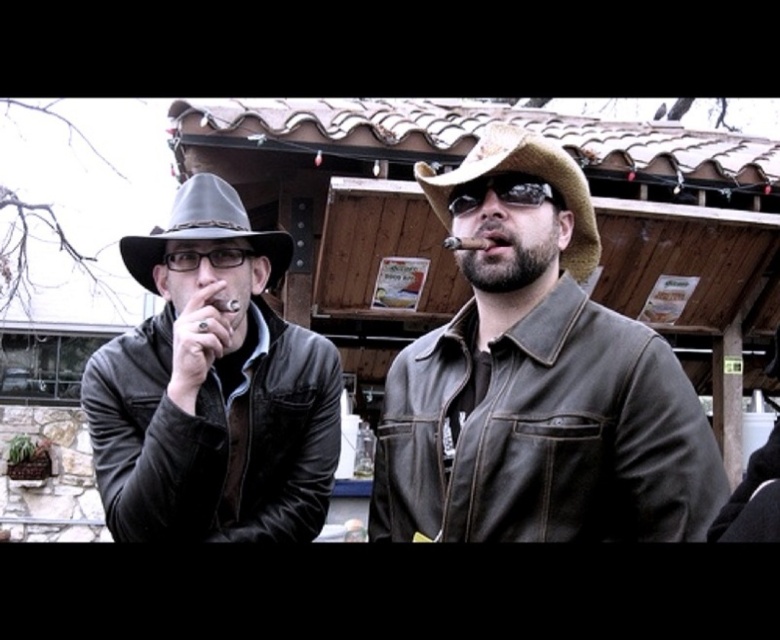
Is brown leather jacket at center to the left of smooth brown cigar at center from the viewer's perspective?

Incorrect, brown leather jacket at center is not on the left side of smooth brown cigar at center.

Does brown leather jacket at center appear on the right side of smooth brown cigar at center?

Correct, you'll find brown leather jacket at center to the right of smooth brown cigar at center.

Locate an element on the screen. This screenshot has height=640, width=780. brown leather jacket at center is located at coordinates click(536, 381).

At what (x,y) coordinates should I click in order to perform the action: click on brown leather jacket at center. Please return your answer as a coordinate pair (x, y). This screenshot has width=780, height=640. Looking at the image, I should click on (536, 381).

Which is above, brown leather jacket at center or matte black leather jacket at left?

brown leather jacket at center is above.

Is brown leather jacket at center smaller than matte black leather jacket at left?

No, brown leather jacket at center is not smaller than matte black leather jacket at left.

Is point (559, 232) closer to viewer compared to point (130, 458)?

That is True.

Identify the location of brown leather jacket at center. The image size is (780, 640). (536, 381).

Which is in front, point (474, 157) or point (217, 230)?

Positioned in front is point (474, 157).

Is point (448, 188) closer to viewer compared to point (208, 236)?

No, (448, 188) is behind (208, 236).

At what (x,y) coordinates should I click in order to perform the action: click on brown leather hat at center. Please return your answer as a coordinate pair (x, y). The width and height of the screenshot is (780, 640). Looking at the image, I should click on (525, 172).